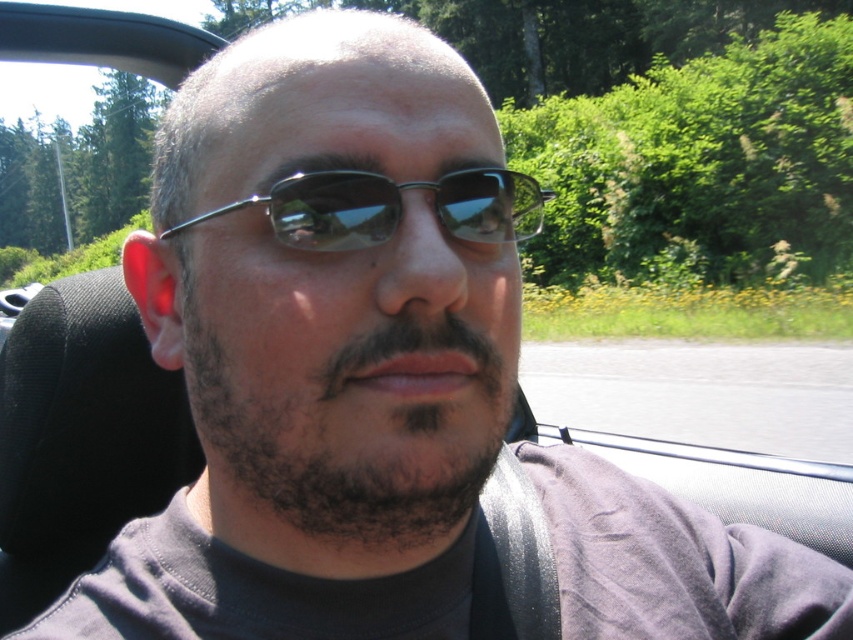
You are a photographer trying to capture a portrait of the person in the convertible car. You notice the dark brown fuzzy beard at center and the metallic frame sunglasses at center. Which object is located below the other?

The dark brown fuzzy beard at center is positioned under the metallic frame sunglasses at center.

You are a photographer trying to capture a portrait of the person in the convertible car. You notice the dark brown fuzzy beard at center and the metallic frame sunglasses at center. Which of these two features is narrower?

The dark brown fuzzy beard at center is narrower than the metallic frame sunglasses at center because its width is less than that of the sunglasses.

You are a photographer trying to capture the facial features of the person in the convertible car. Since you want to focus on the dark brown fuzzy beard at center and the metallic frame sunglasses at center, which one is positioned to the left of the other?

The dark brown fuzzy beard at center is to the left of metallic frame sunglasses at center.